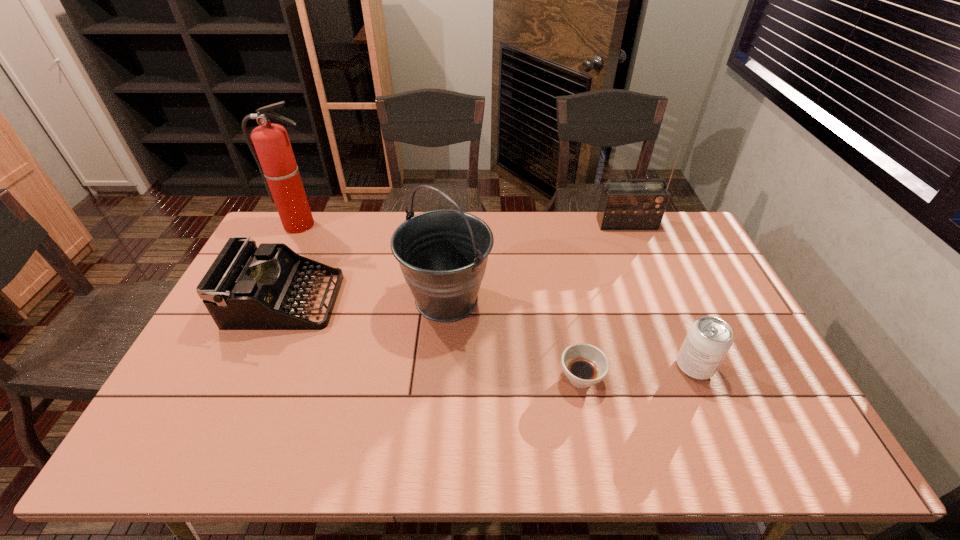
Locate an element on the screen. object positioned at the far left corner is located at coordinates (274, 156).

You are a GUI agent. You are given a task and a screenshot of the screen. Output one action in this format:
    pyautogui.click(x=<x>, y=<y>)
    Task: Click on the object that is positioned at the far right corner
    This screenshot has height=540, width=960.
    Given the screenshot: What is the action you would take?
    pyautogui.click(x=623, y=205)

In the image, there is a desktop. Where is `free space at the far edge`? This screenshot has height=540, width=960. free space at the far edge is located at coordinates (596, 240).

Where is `vacant space at the near edge`? Image resolution: width=960 pixels, height=540 pixels. vacant space at the near edge is located at coordinates (246, 438).

At what (x,y) coordinates should I click in order to perform the action: click on vacant region at the right edge of the desktop. Please return your answer as a coordinate pair (x, y). Looking at the image, I should click on (786, 405).

In order to click on vacant space at the far right corner of the desktop in this screenshot , I will do `click(670, 218)`.

I want to click on free location at the near right corner, so click(773, 428).

Find the location of a particular element. Image resolution: width=960 pixels, height=540 pixels. free space between the soda can and the radio receiver is located at coordinates (660, 295).

Identify the location of free spot between the soda can and the typewriter. (490, 334).

I want to click on free point between the shortest object and the second tallest object, so click(x=514, y=339).